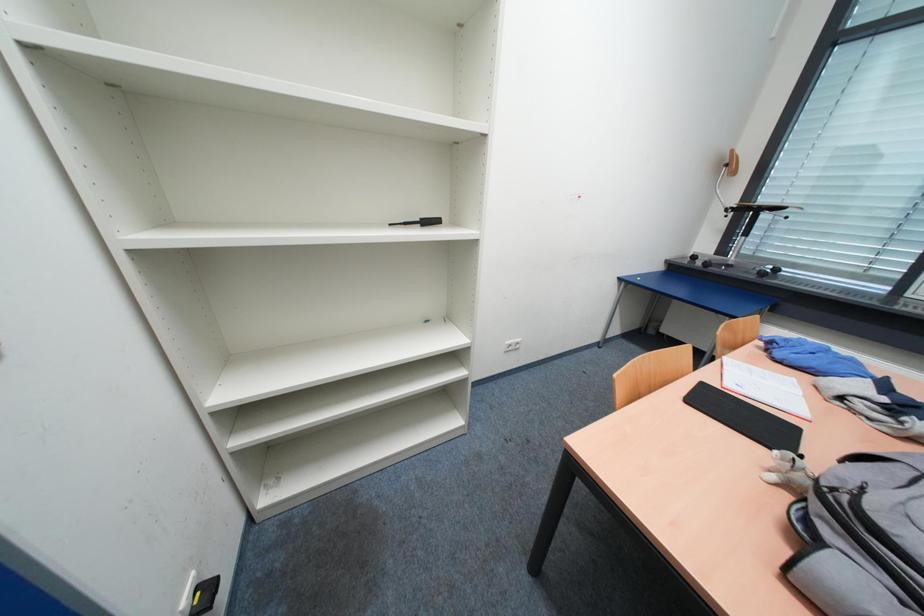
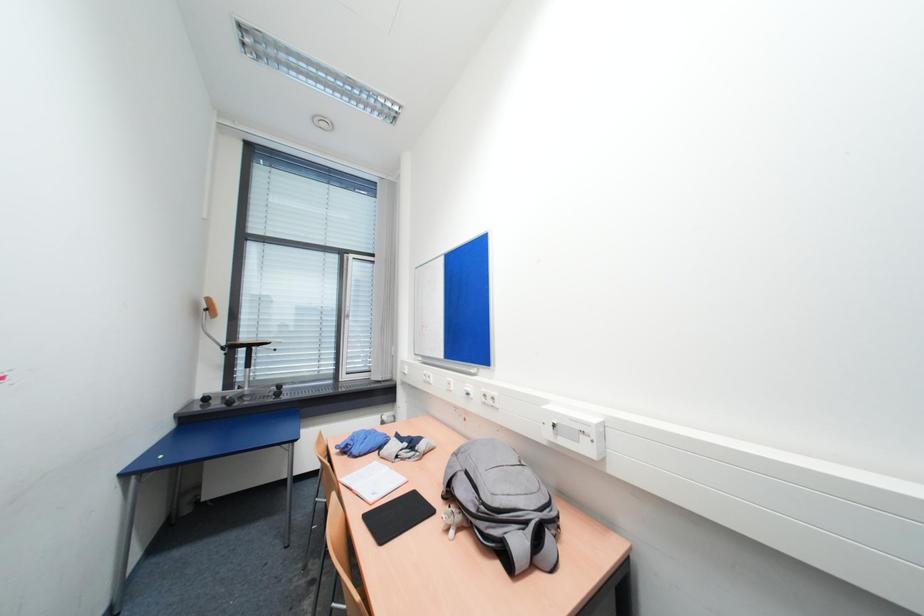
Question: The camera is either moving clockwise (left) or counter-clockwise (right) around the object. The first image is from the beginning of the video and the second image is from the end. Is the camera moving left or right when shooting the video?

Choices:
 (A) Left
 (B) Right

Answer: (A)